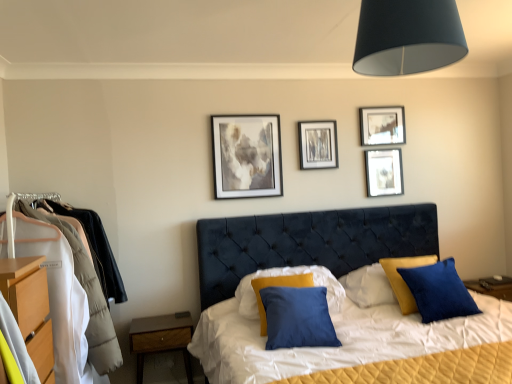
Question: In terms of height, does wooden dresser at left look taller or shorter compared to matte gray painting at upper center, marked as the 1th picture frame in a left-to-right arrangement?

Choices:
 (A) tall
 (B) short

Answer: (A)

Question: From the image's perspective, is wooden dresser at left located above or below matte gray painting at upper center, marked as the 1th picture frame in a left-to-right arrangement?

Choices:
 (A) below
 (B) above

Answer: (A)

Question: Based on their relative distances, which object is farther from the black matte lampshade at upper center?

Choices:
 (A) matte black picture frame at upper right, the third picture frame positioned from the left
 (B) wooden dresser at left
 (C) brown wood nightstand at lower left
 (D) matte gray painting at upper center, marked as the 1th picture frame in a left-to-right arrangement
 (E) metallic silver picture frame at upper center, which is the second picture frame in left-to-right order

Answer: (C)

Question: Which object is the farthest from the matte silver picture frame at upper right, the 1th picture frame from the right?

Choices:
 (A) metallic silver picture frame at upper center, the 3th picture frame in the right-to-left sequence
 (B) wooden dresser at left
 (C) brown wood nightstand at lower left
 (D) matte gray painting at upper center, which appears as the fourth picture frame when viewed from the right
 (E) black matte lampshade at upper center

Answer: (B)